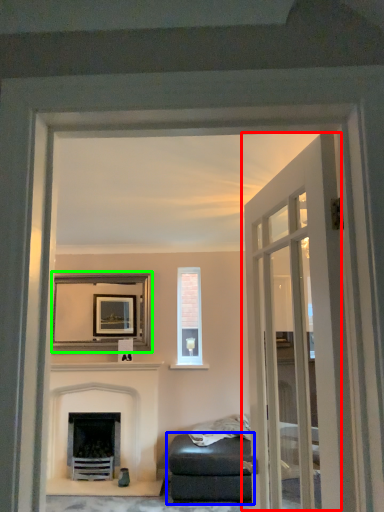
Question: Which object is the farthest from door (highlighted by a red box)? Choose among these: studio couch (highlighted by a blue box) or picture frame (highlighted by a green box).

Choices:
 (A) studio couch
 (B) picture frame

Answer: (B)